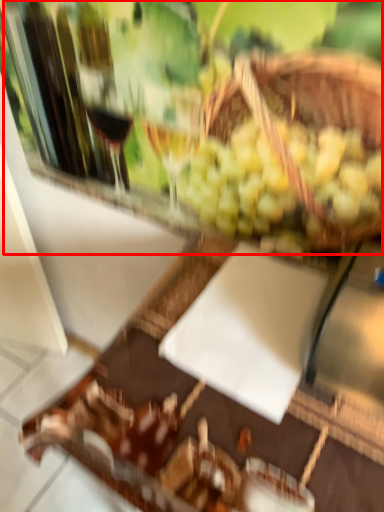
Question: In this image, where is wine tasting (annotated by the red box) located relative to table?

Choices:
 (A) right
 (B) left

Answer: (B)